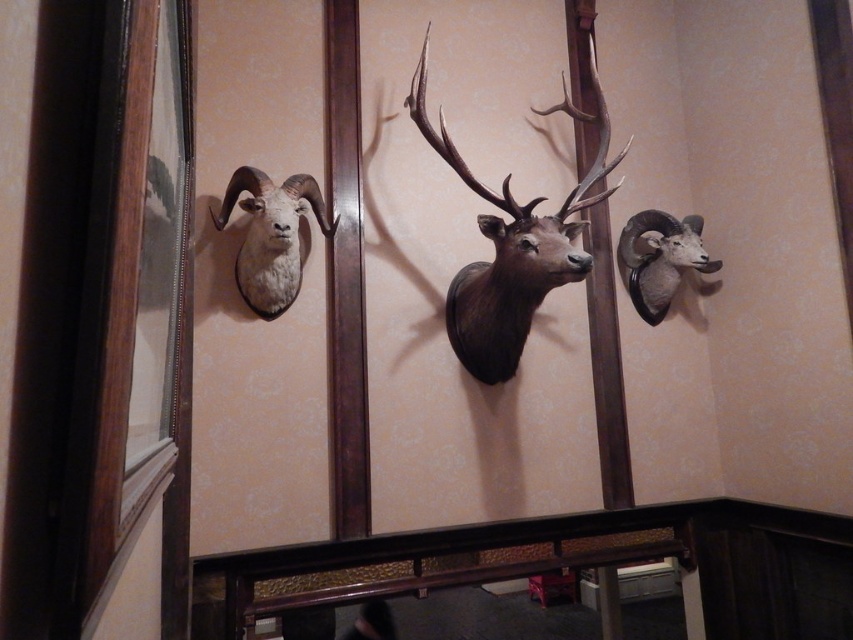
Question: Which object appears farthest from the camera in this image?

Choices:
 (A) white matte ram head at left
 (B) polished brown moose head at center
 (C) white matte ram head at upper left

Answer: (C)

Question: Does polished brown moose head at center have a greater width compared to white matte ram head at upper left?

Choices:
 (A) no
 (B) yes

Answer: (B)

Question: Does polished brown moose head at center appear over white matte ram head at left?

Choices:
 (A) yes
 (B) no

Answer: (A)

Question: Which object appears farthest from the camera in this image?

Choices:
 (A) white matte ram head at left
 (B) polished brown moose head at center
 (C) white matte ram head at upper left

Answer: (C)

Question: Is polished brown moose head at center above white matte ram head at upper left?

Choices:
 (A) yes
 (B) no

Answer: (A)

Question: Among these points, which one is nearest to the camera?

Choices:
 (A) (585, 266)
 (B) (289, 214)

Answer: (A)